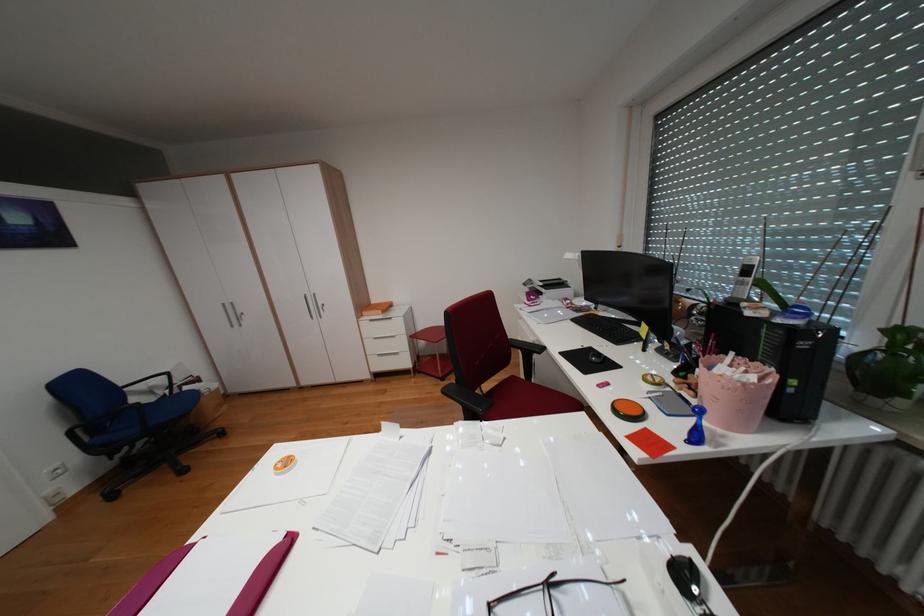
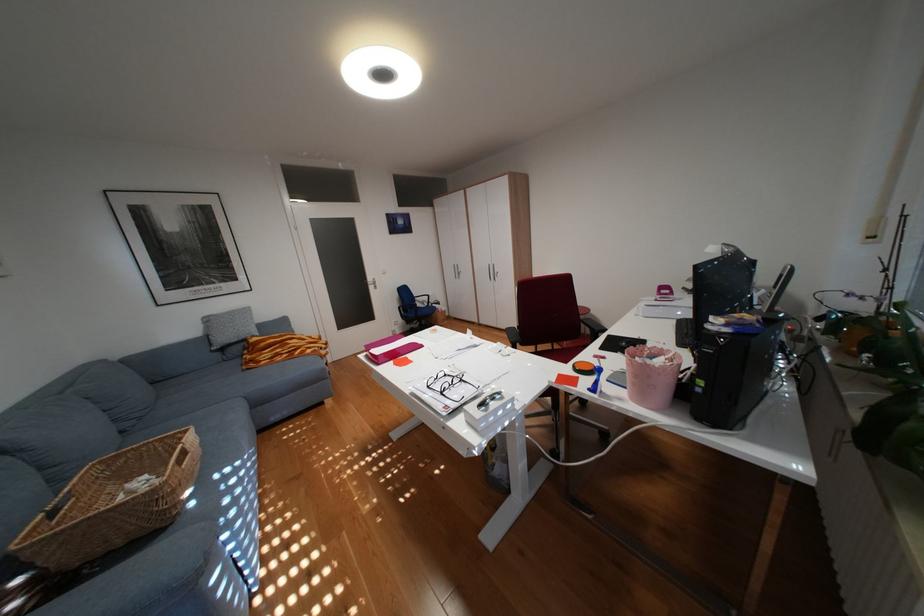
In the second image, find the point that corresponds to [525,349] in the first image.

(594, 323)